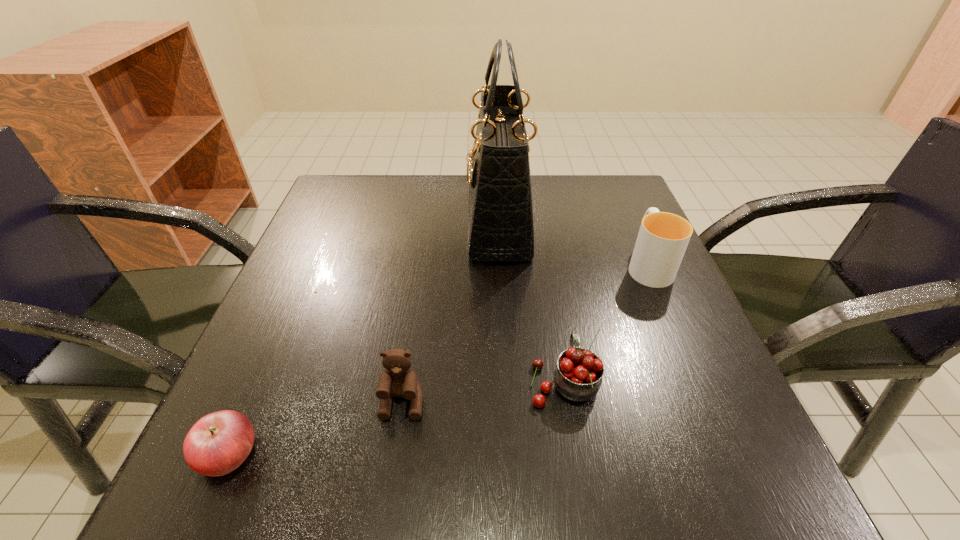
Where is `the tallest object`? the tallest object is located at coordinates (500, 213).

The width and height of the screenshot is (960, 540). What are the coordinates of `the rightmost object` in the screenshot? It's located at (663, 237).

The height and width of the screenshot is (540, 960). I want to click on cherry, so click(x=578, y=375).

At what (x,y) coordinates should I click in order to perform the action: click on the fourth object from right to left. Please return your answer as a coordinate pair (x, y). Looking at the image, I should click on (398, 380).

Identify the location of the leftmost object. Image resolution: width=960 pixels, height=540 pixels. (218, 443).

Locate an element on the screen. The height and width of the screenshot is (540, 960). apple is located at coordinates (218, 443).

What are the coordinates of `free space located at the front of the handbag with visible charms` in the screenshot? It's located at (401, 224).

This screenshot has width=960, height=540. I want to click on blank space located at the front of the handbag with visible charms, so click(362, 224).

I want to click on vacant point located at the front of the handbag with visible charms, so click(x=325, y=224).

Locate an element on the screen. vacant space positioned with the handle on the side of the rightmost object is located at coordinates (625, 212).